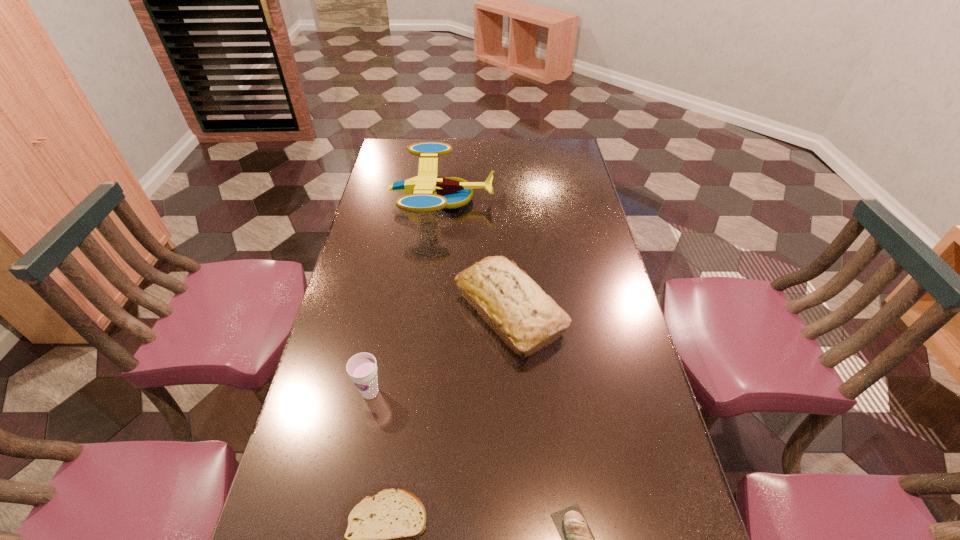
Locate an element on the screen. the farthest object is located at coordinates (428, 192).

I want to click on bread, so click(527, 319).

Image resolution: width=960 pixels, height=540 pixels. I want to click on cup, so click(362, 368).

This screenshot has width=960, height=540. What are the coordinates of `free region located at the cockpit of the farthest object` in the screenshot? It's located at (570, 200).

Locate an element on the screen. This screenshot has width=960, height=540. free space located on the left of the fourth nearest object is located at coordinates (429, 311).

Locate an element on the screen. Image resolution: width=960 pixels, height=540 pixels. vacant space situated on the back of the cup is located at coordinates (391, 286).

Find the location of a particular element. The image size is (960, 540). drone located in the left edge section of the desktop is located at coordinates (428, 192).

The height and width of the screenshot is (540, 960). Identify the location of cup present at the left edge. (362, 368).

Where is `vacant region at the far edge of the desktop`? This screenshot has width=960, height=540. vacant region at the far edge of the desktop is located at coordinates (528, 146).

In the image, there is a desktop. Find the location of `vacant space at the left edge`. vacant space at the left edge is located at coordinates (400, 227).